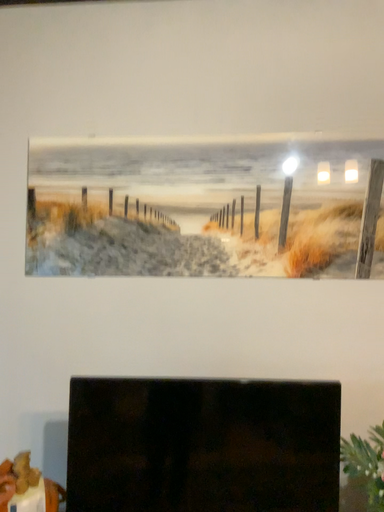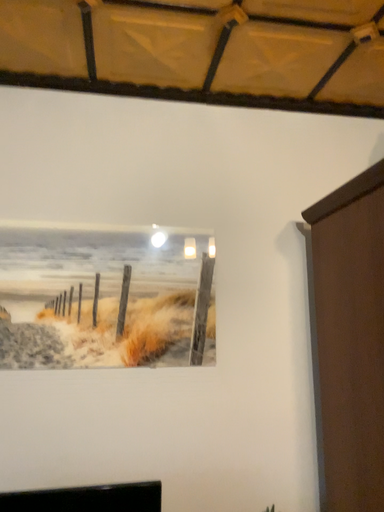
Question: How did the camera likely rotate when shooting the video?

Choices:
 (A) rotated upward
 (B) rotated downward

Answer: (A)